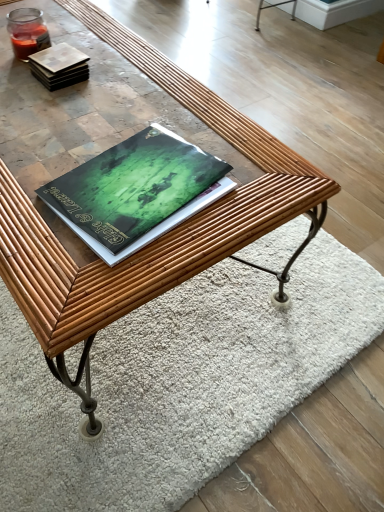
You are a GUI agent. You are given a task and a screenshot of the screen. Output one action in this format:
    pyautogui.click(x=<x>, y=<y>)
    Task: Click on the vacant area that lies between green matte book at center, acting as the second book starting from the back, and matte brown tile at upper left, which is the 2th book in bottom-to-top order
    The width and height of the screenshot is (384, 512).
    Given the screenshot: What is the action you would take?
    pyautogui.click(x=89, y=122)